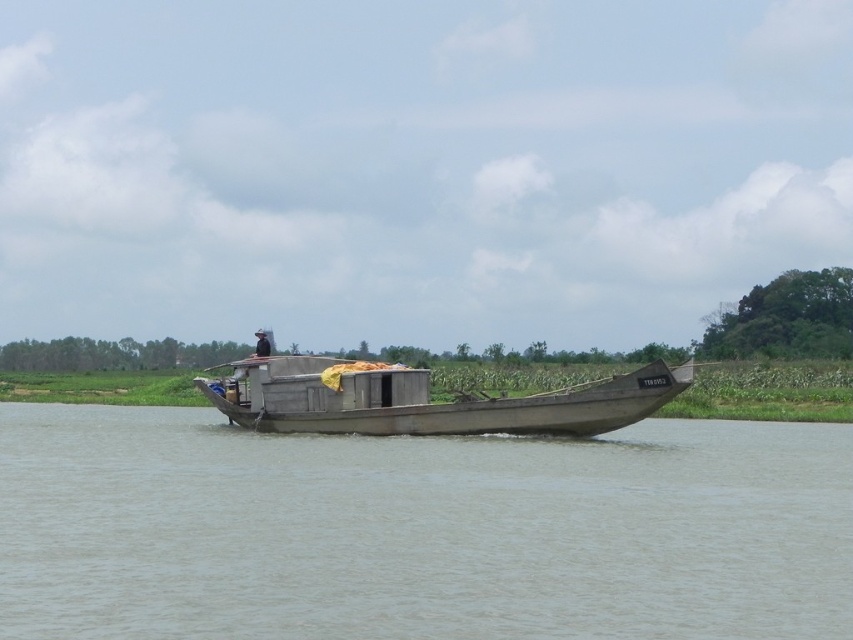
Question: Is gray wooden boat at center further to the viewer compared to wooden boat at center?

Choices:
 (A) no
 (B) yes

Answer: (A)

Question: Is gray wooden boat at center closer to the viewer compared to wooden boat at center?

Choices:
 (A) no
 (B) yes

Answer: (B)

Question: Which point is closer to the camera?

Choices:
 (A) (425, 374)
 (B) (701, 596)

Answer: (B)

Question: Can you confirm if gray wooden boat at center is bigger than wooden boat at center?

Choices:
 (A) no
 (B) yes

Answer: (B)